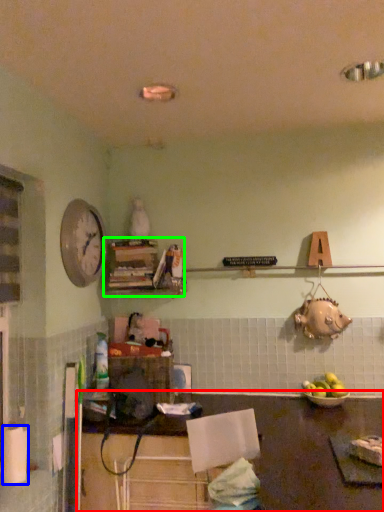
Question: Considering the real-world distances, which object is farthest from table (highlighted by a red box)? paper towel (highlighted by a blue box) or shelf (highlighted by a green box)?

Choices:
 (A) paper towel
 (B) shelf

Answer: (A)